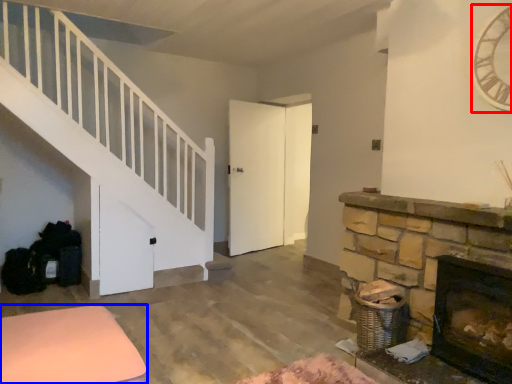
Question: Which of the following is the farthest to the observer, clock (highlighted by a red box) or furniture (highlighted by a blue box)?

Choices:
 (A) clock
 (B) furniture

Answer: (A)